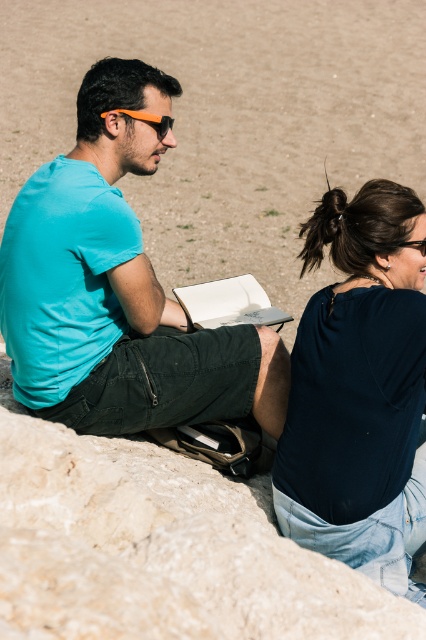
You are standing in the desert scene and want to place a small flag at the point closer to you. Which point should you choose between point [58,227] and point [403,243]?

Point [58,227] is closer to you, so you should place the flag there.

You are a photographer aiming to capture a portrait of the two people in the scene. You want to ensure that both the dark blue fabric shirt at upper right and the orange matte goggles at upper center are clearly visible in the frame. Based on their sizes, which object should you focus on to ensure both are in focus?

The dark blue fabric shirt at upper right is taller than the orange matte goggles at upper center. To ensure both are in focus, focus on the dark blue fabric shirt at upper right since it is the larger object, allowing the smaller orange matte goggles at upper center to remain within the depth of field.